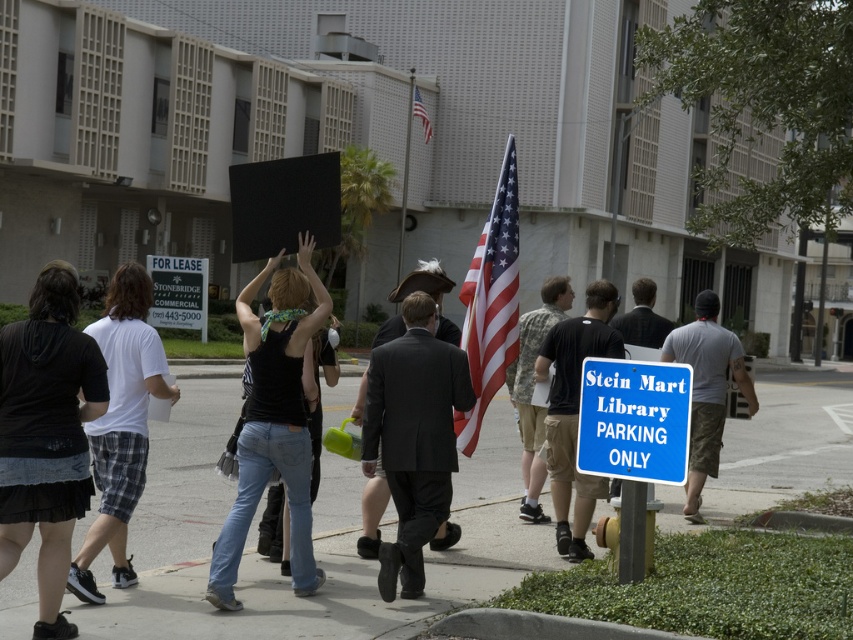
Looking at this image, you are a delivery person trying to navigate through the area. You see the concrete sidewalk at center and the blue plastic sign at lower right. Which object is wider?

The concrete sidewalk at center is wider than the blue plastic sign at lower right.

You are a delivery person trying to park your van in the Stein Mart Library Parking Only area. The van is 2 meters wide. The parking space has a concrete sidewalk at center and an american flag at center. Which object would you need to avoid hitting if you want to park without damaging anything? Explain your reasoning.

The concrete sidewalk at center is larger in size than the american flag at center. Therefore, when parking, you should avoid hitting the concrete sidewalk at center since it is larger and more likely to be in the path of the van. The american flag at center, being smaller, might be easier to navigate around without collision.

Looking at this image, you are a photographer trying to take a photo of the dark gray suit at center and the black cotton hoodie at left. Which object should you focus on first to ensure it appears larger in the photo?

The black cotton hoodie at left is much taller than the dark gray suit at center, so you should focus on the black cotton hoodie at left first to capture its larger size in the photo.